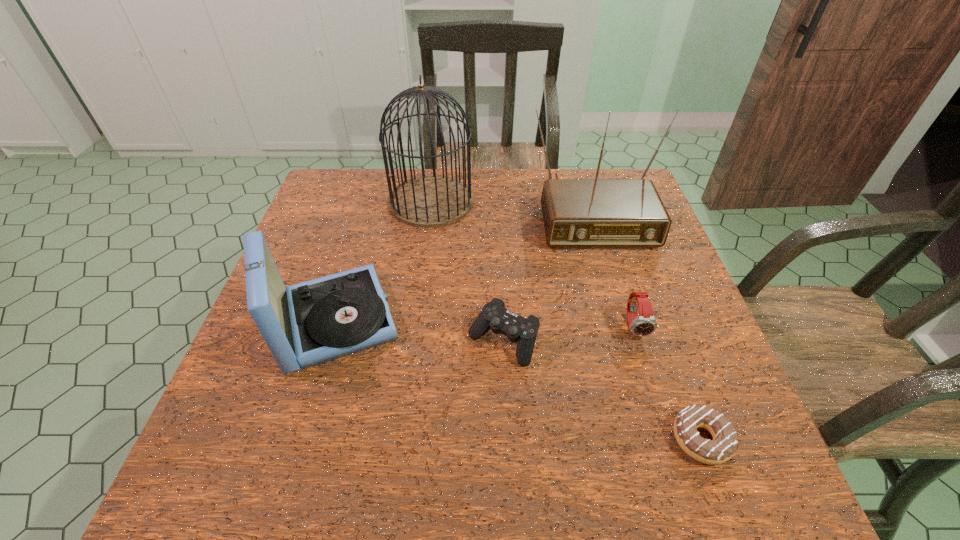
Find the location of a particular element. Image resolution: width=960 pixels, height=540 pixels. free spot located 0.280m on the face of the watch is located at coordinates [683, 478].

Image resolution: width=960 pixels, height=540 pixels. I want to click on vacant space located 0.310m on the left of the second shortest object, so click(x=323, y=341).

This screenshot has height=540, width=960. In order to click on blank area located 0.080m on the left of the nearest object in this screenshot , I will do `click(627, 439)`.

At what (x,y) coordinates should I click in order to perform the action: click on birdcage located at the far edge. Please return your answer as a coordinate pair (x, y). The height and width of the screenshot is (540, 960). Looking at the image, I should click on (429, 201).

The width and height of the screenshot is (960, 540). Find the location of `radio_receiver present at the far edge`. radio_receiver present at the far edge is located at coordinates (577, 213).

Find the location of `object located in the near edge section of the desktop`. object located in the near edge section of the desktop is located at coordinates (724, 444).

Where is `object positioned at the left edge`? Image resolution: width=960 pixels, height=540 pixels. object positioned at the left edge is located at coordinates (313, 322).

Find the location of `radio_receiver present at the right edge`. radio_receiver present at the right edge is located at coordinates (577, 213).

The height and width of the screenshot is (540, 960). What are the coordinates of `watch at the right edge` in the screenshot? It's located at (644, 324).

This screenshot has height=540, width=960. In order to click on doughnut situated at the right edge in this screenshot , I will do `click(724, 444)`.